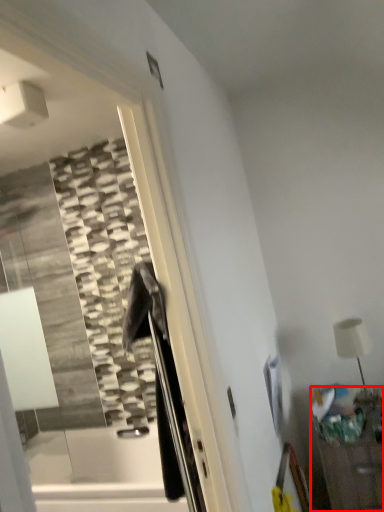
Question: From the image's perspective, where is furniture (annotated by the red box) located relative to table lamp?

Choices:
 (A) below
 (B) above

Answer: (A)